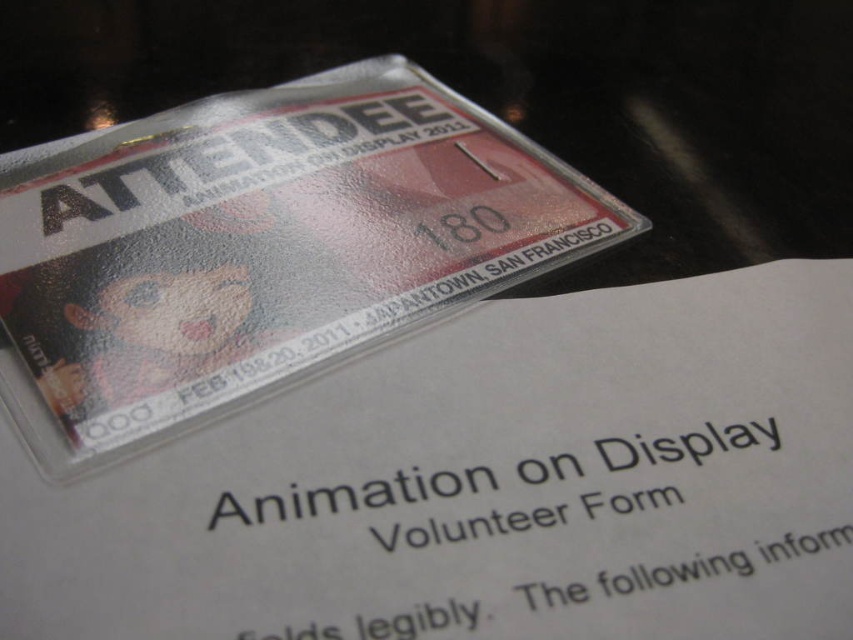
Question: Which point is closer to the camera taking this photo?

Choices:
 (A) (286, 576)
 (B) (0, 385)

Answer: (A)

Question: Which of the following is the farthest from the observer?

Choices:
 (A) glossy plastic badge at upper center
 (B) white glossy paper at upper center

Answer: (A)

Question: Does white glossy paper at upper center appear under glossy plastic badge at upper center?

Choices:
 (A) yes
 (B) no

Answer: (A)

Question: Considering the relative positions of white glossy paper at upper center and glossy plastic badge at upper center in the image provided, where is white glossy paper at upper center located with respect to glossy plastic badge at upper center?

Choices:
 (A) right
 (B) left

Answer: (A)

Question: Is white glossy paper at upper center to the right of glossy plastic badge at upper center from the viewer's perspective?

Choices:
 (A) no
 (B) yes

Answer: (B)